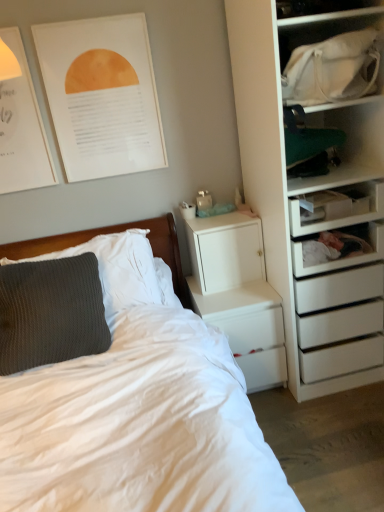
Question: Is there a large distance between white soft bed at left and white matte/file cabinet at upper right?

Choices:
 (A) yes
 (B) no

Answer: (B)

Question: Is white soft bed at left positioned with its back to white matte/file cabinet at upper right?

Choices:
 (A) yes
 (B) no

Answer: (B)

Question: Does white soft bed at left have a lesser height compared to white matte/file cabinet at upper right?

Choices:
 (A) yes
 (B) no

Answer: (B)

Question: Is the depth of white soft bed at left greater than that of white matte/file cabinet at upper right?

Choices:
 (A) yes
 (B) no

Answer: (B)

Question: Could you tell me if white soft bed at left is turned towards white matte/file cabinet at upper right?

Choices:
 (A) no
 (B) yes

Answer: (A)

Question: Does point (119, 417) appear closer or farther from the camera than point (193, 263)?

Choices:
 (A) closer
 (B) farther

Answer: (A)

Question: From a real-world perspective, is white soft bed at left above or below white matte/file cabinet at upper right?

Choices:
 (A) below
 (B) above

Answer: (A)

Question: Would you say white soft bed at left is inside or outside white matte/file cabinet at upper right?

Choices:
 (A) inside
 (B) outside

Answer: (B)

Question: Relative to white matte/file cabinet at upper right, is white soft bed at left in front or behind?

Choices:
 (A) behind
 (B) front

Answer: (B)

Question: In terms of size, does white glossy nightstand at lower center appear bigger or smaller than white paper poster at upper left, the 2th poster page when ordered from left to right?

Choices:
 (A) big
 (B) small

Answer: (A)

Question: Considering the positions of point (251, 309) and point (82, 133), is point (251, 309) closer or farther from the camera than point (82, 133)?

Choices:
 (A) closer
 (B) farther

Answer: (A)

Question: Is white glossy nightstand at lower center wider or thinner than white paper poster at upper left, the first poster page in the right-to-left sequence?

Choices:
 (A) thin
 (B) wide

Answer: (B)

Question: From the image's perspective, is white glossy nightstand at lower center positioned above or below white paper poster at upper left, the 2th poster page when ordered from left to right?

Choices:
 (A) above
 (B) below

Answer: (B)

Question: From the image's perspective, relative to matte paper poster at upper left, the first poster page when ordered from left to right, is white plastic drawer at right above or below?

Choices:
 (A) below
 (B) above

Answer: (A)

Question: Is white plastic drawer at right taller or shorter than matte paper poster at upper left, the first poster page when ordered from left to right?

Choices:
 (A) short
 (B) tall

Answer: (A)